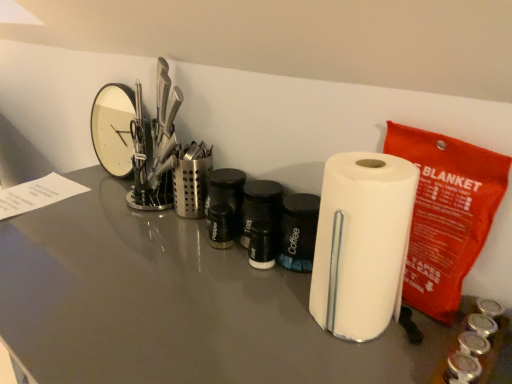
Locate an element on the screen. This screenshot has height=384, width=512. vacant region to the left of white matte paper towel at center is located at coordinates 251,313.